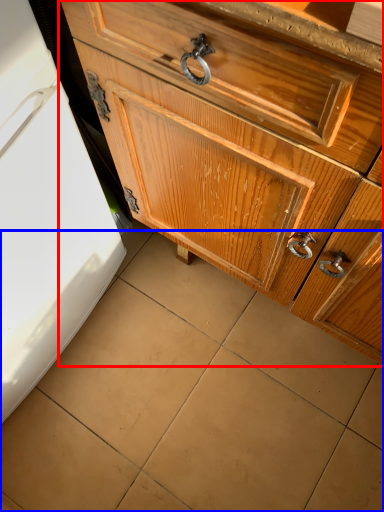
Question: Which object is closer to the camera taking this photo, chest of drawers (highlighted by a red box) or tile (highlighted by a blue box)?

Choices:
 (A) chest of drawers
 (B) tile

Answer: (A)